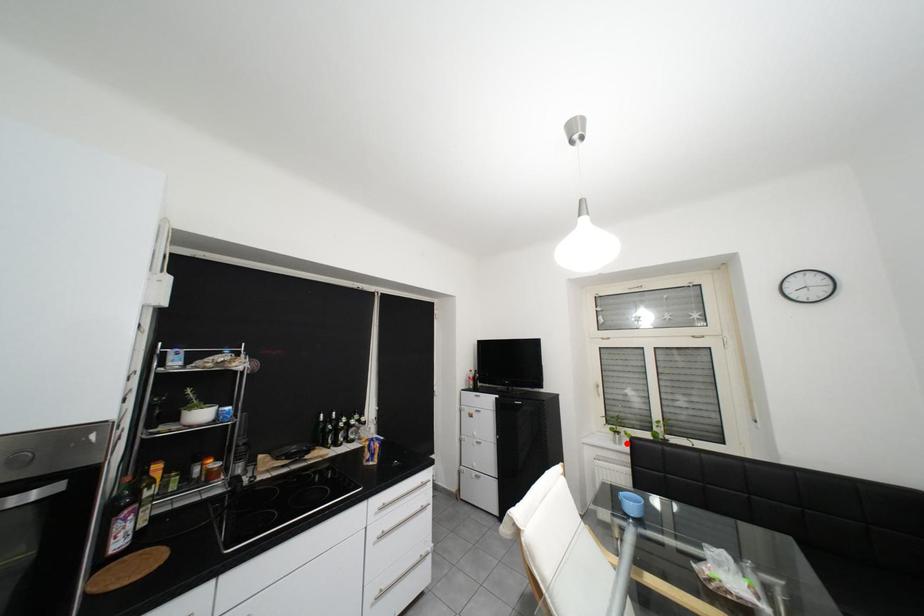
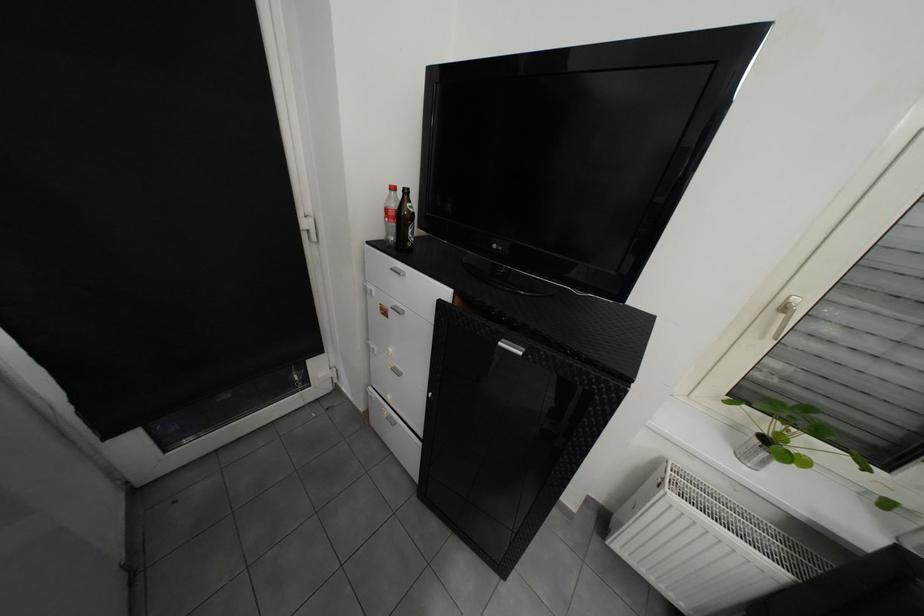
Question: I am providing you with two images of the same scene from different viewpoints. In image1, a red point is highlighted. Considering the same 3D point in image2, which of the following is correct?

Choices:
 (A) It is closer
 (B) It is farther

Answer: (A)